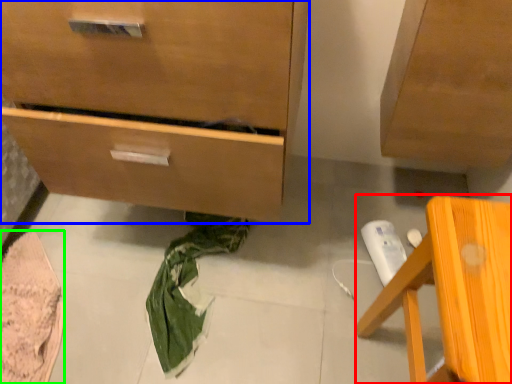
Question: Which object is the closest to the furniture (highlighted by a red box)? Choose among these: chest of drawers (highlighted by a blue box) or material (highlighted by a green box).

Choices:
 (A) chest of drawers
 (B) material

Answer: (A)